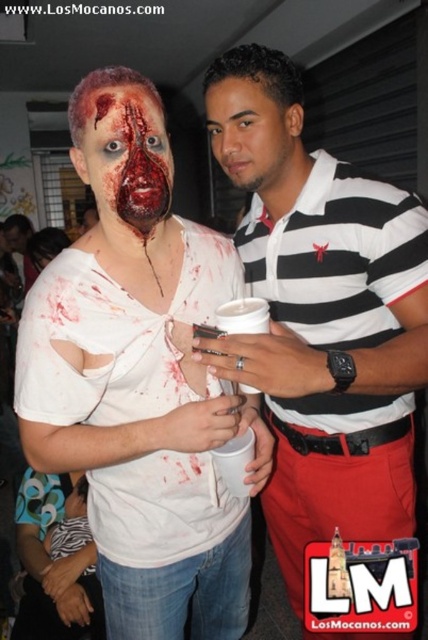
Does matte flesh-colored makeup at center appear over smooth skin face at center?

No, matte flesh-colored makeup at center is not above smooth skin face at center.

Is matte flesh-colored makeup at center to the left of smooth skin face at center from the viewer's perspective?

Correct, you'll find matte flesh-colored makeup at center to the left of smooth skin face at center.

Does point (95, 184) come behind point (285, 186)?

No, (95, 184) is in front of (285, 186).

Locate an element on the screen. matte flesh-colored makeup at center is located at coordinates (127, 156).

Who is lower down, striped polo shirt at center or smooth skin face at center?

striped polo shirt at center is lower down.

Is striped polo shirt at center positioned before smooth skin face at center?

Yes, it is.

Describe the element at coordinates (321, 316) in the screenshot. I see `striped polo shirt at center` at that location.

Locate an element on the screen. striped polo shirt at center is located at coordinates (321, 316).

From the picture: Can you confirm if matte white shirt at center is positioned below matte flesh-colored makeup at center?

Yes.

Between point (127, 554) and point (157, 104), which one is positioned in front?

Positioned in front is point (157, 104).

Which is behind, point (180, 349) or point (98, 122)?

The point (180, 349) is behind.

The width and height of the screenshot is (428, 640). Find the location of `matte white shirt at center`. matte white shirt at center is located at coordinates (139, 380).